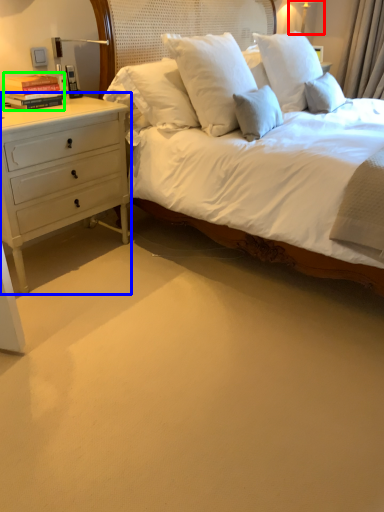
Question: Which object is the closest to the bedside lamp (highlighted by a red box)? Choose among these: chest of drawers (highlighted by a blue box) or book (highlighted by a green box).

Choices:
 (A) chest of drawers
 (B) book

Answer: (B)